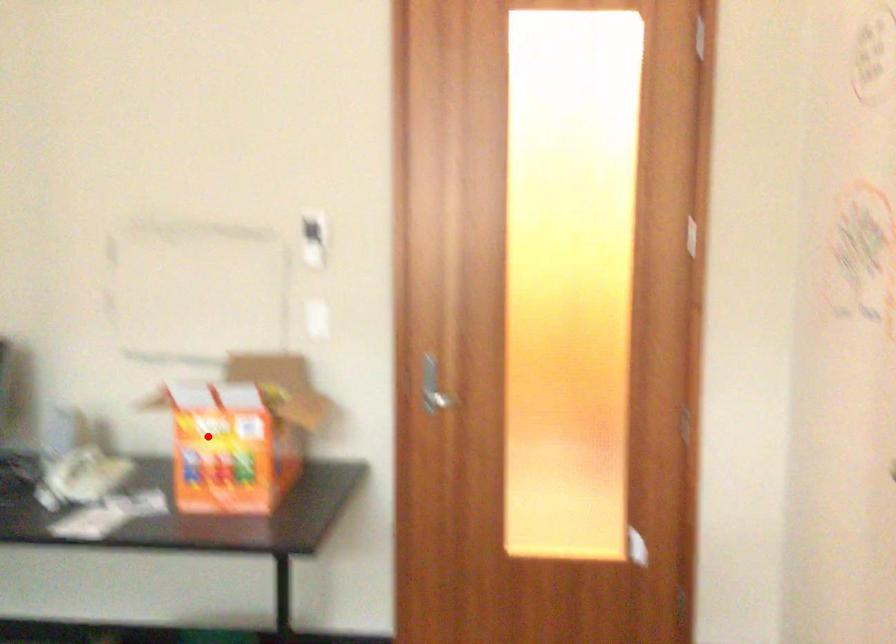
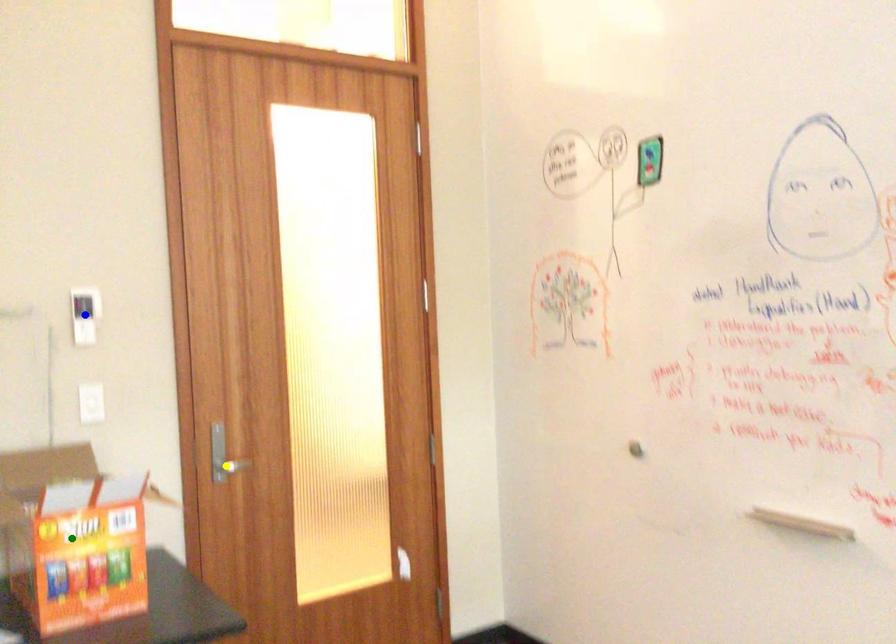
Question: I am providing you with two images of the same scene from different viewpoints. A red point is marked on the first image. You are given multiple points on the second image. Which mark in image 2 goes with the point in image 1?

Choices:
 (A) blue point
 (B) green point
 (C) yellow point

Answer: (B)